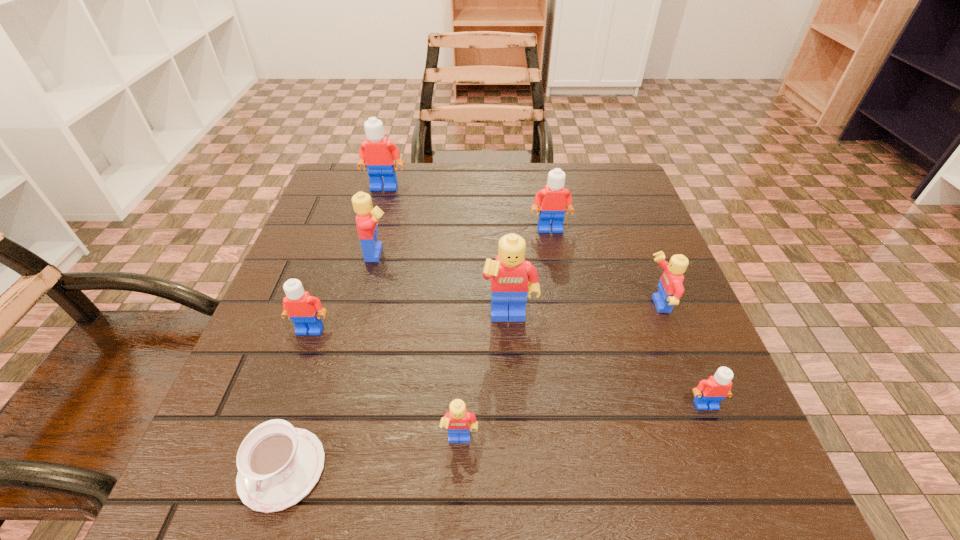
The width and height of the screenshot is (960, 540). I want to click on free space located on the face of the third biggest yellow Lego, so click(440, 306).

The height and width of the screenshot is (540, 960). In order to click on free space located on the face of the third biggest yellow Lego in this screenshot , I will do `click(552, 306)`.

You are a GUI agent. You are given a task and a screenshot of the screen. Output one action in this format:
    pyautogui.click(x=<x>, y=<y>)
    Task: Click on the vacant area situated 0.180m on the face of the third farthest white Lego
    The image size is (960, 540).
    Given the screenshot: What is the action you would take?
    pyautogui.click(x=274, y=433)

What are the coordinates of `vacant area situated 0.050m on the face of the nearest Lego` in the screenshot? It's located at (459, 491).

Find the location of a particular element. The image size is (960, 540). vacant space located 0.100m on the face of the third nearest object is located at coordinates (735, 477).

You are a GUI agent. You are given a task and a screenshot of the screen. Output one action in this format:
    pyautogui.click(x=<x>, y=<y>)
    Task: Click on the object positioned at the far edge
    
    Given the screenshot: What is the action you would take?
    pyautogui.click(x=377, y=153)

The height and width of the screenshot is (540, 960). What are the coordinates of `Lego present at the near edge` in the screenshot? It's located at (459, 422).

Locate an element on the screen. The image size is (960, 540). teacup situated at the near edge is located at coordinates (278, 465).

What are the coordinates of `teacup that is positioned at the left edge` in the screenshot? It's located at (278, 465).

Where is `object located at the far left corner`? The image size is (960, 540). object located at the far left corner is located at coordinates (377, 153).